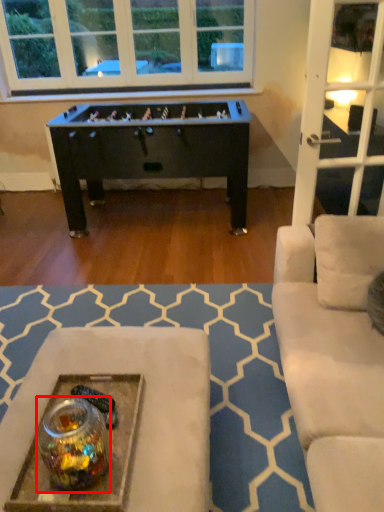
Question: From the image's perspective, what is the correct spatial relationship of glass jar (annotated by the red box) in relation to table?

Choices:
 (A) below
 (B) above

Answer: (B)